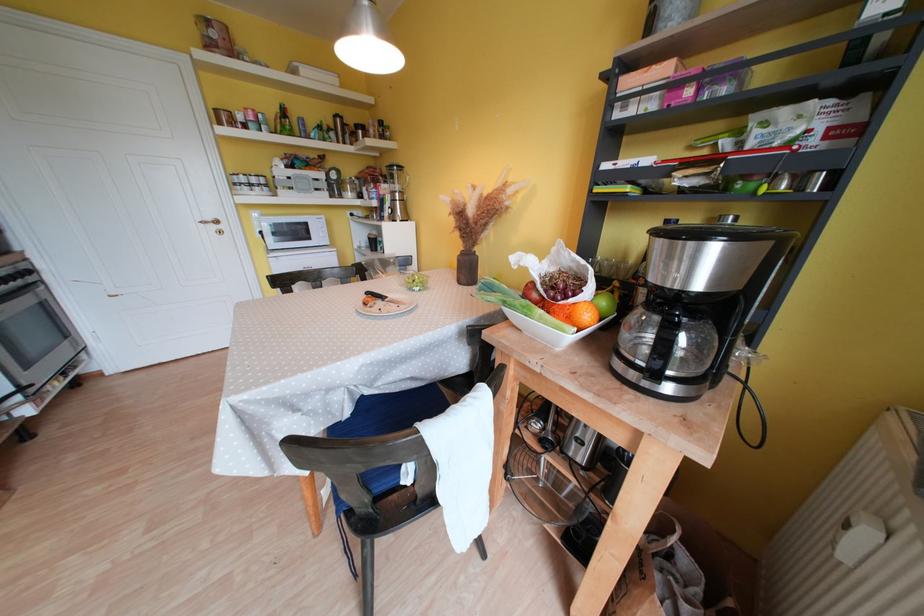
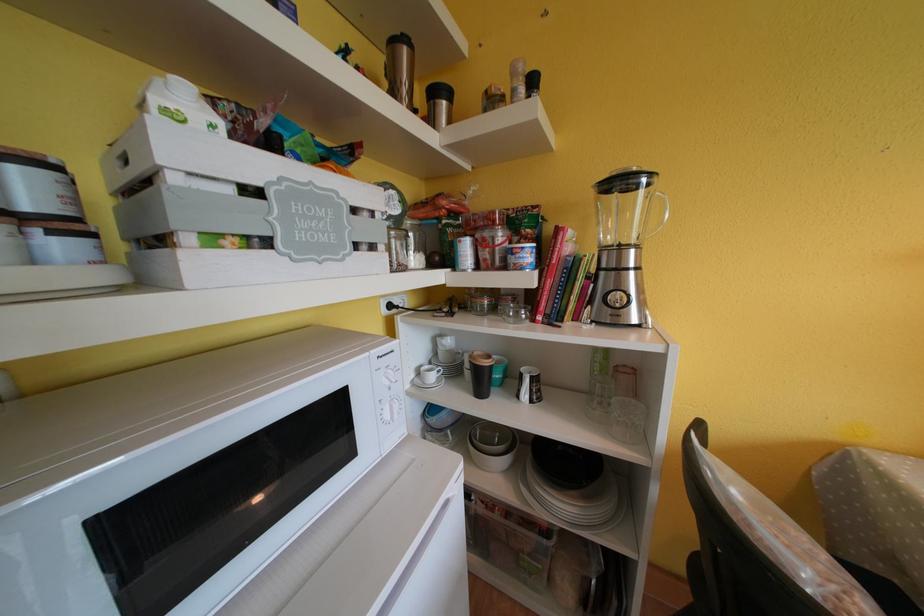
In the second image, find the point that corresponds to pixel 359 217 in the first image.

(396, 310)